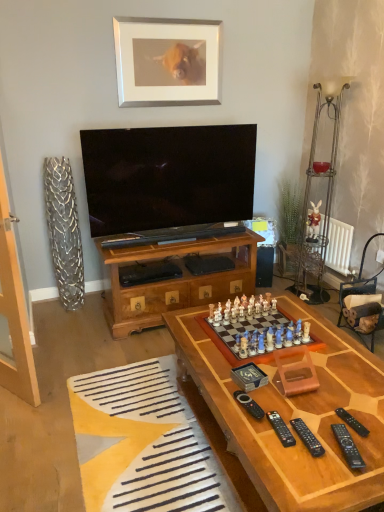
Identify the location of empty space that is in between black plastic remote at lower right, the first remote when ordered from right to left, and black plastic remote at lower right, the third remote in the left-to-right sequence. (324, 430).